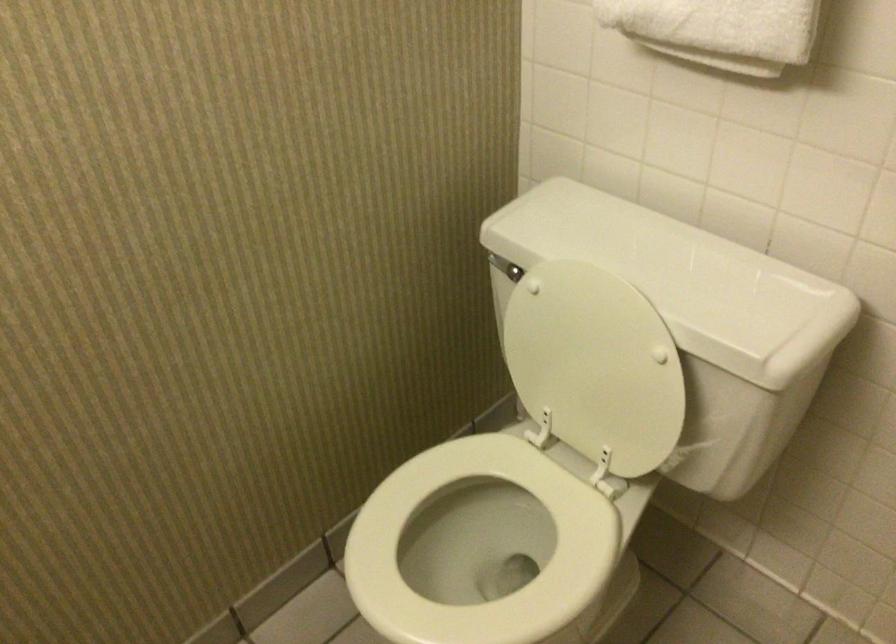
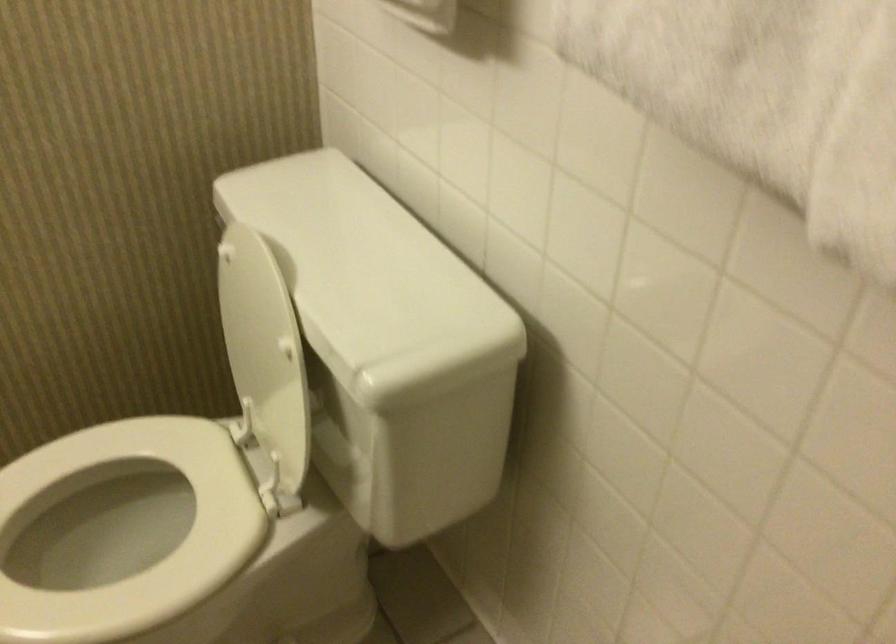
Where in the second image is the point corresponding to point 424,565 from the first image?

(97, 545)